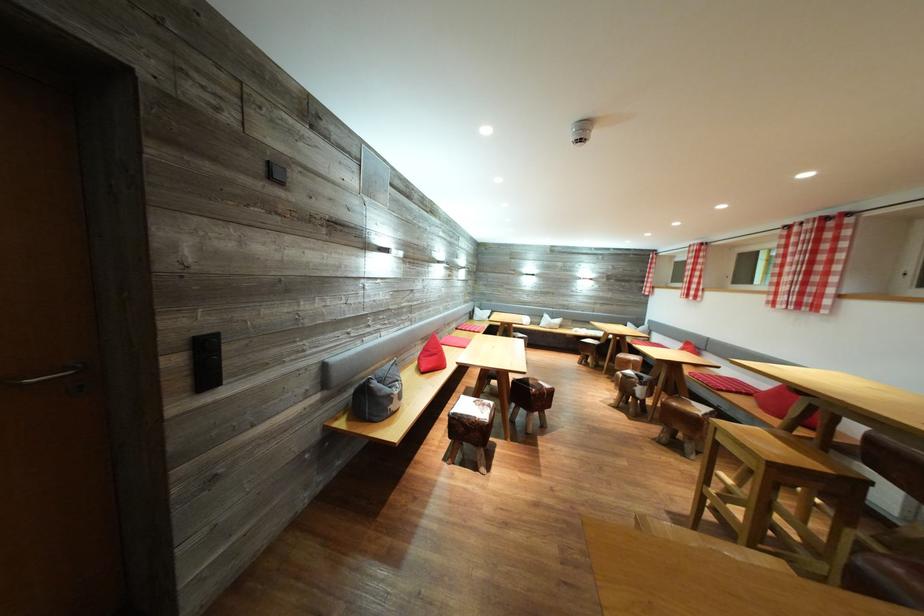
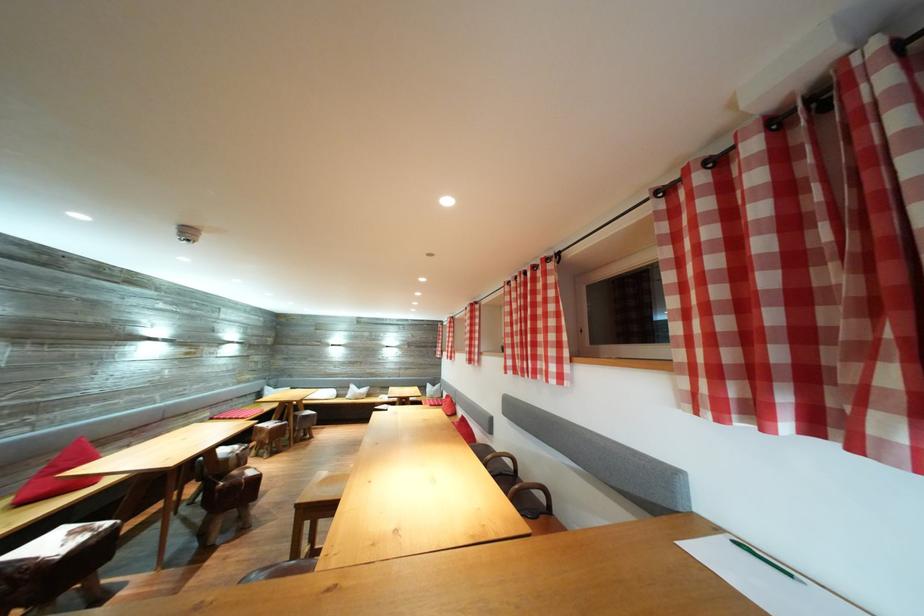
Find the pixel in the second image that matches [553,322] in the first image.

(359, 392)